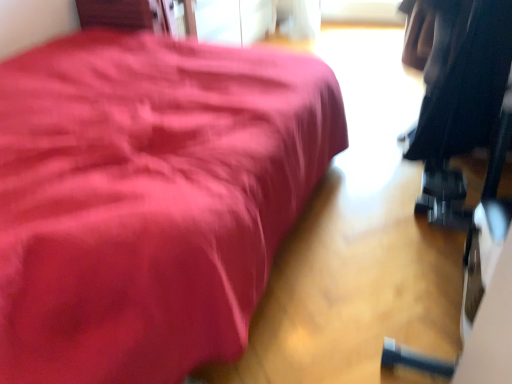
Question: Is matte black dumbbell at lower right wider or thinner than black fabric at right?

Choices:
 (A) thin
 (B) wide

Answer: (B)

Question: From a real-world perspective, relative to black fabric at right, is matte black dumbbell at lower right vertically above or below?

Choices:
 (A) below
 (B) above

Answer: (A)

Question: Does point (101, 382) appear closer or farther from the camera than point (471, 21)?

Choices:
 (A) closer
 (B) farther

Answer: (A)

Question: From the image's perspective, is black fabric at right positioned above or below matte black dumbbell at lower right?

Choices:
 (A) above
 (B) below

Answer: (B)

Question: Is black fabric at right inside or outside of matte black dumbbell at lower right?

Choices:
 (A) inside
 (B) outside

Answer: (B)

Question: Looking at their shapes, would you say black fabric at right is wider or thinner than matte black dumbbell at lower right?

Choices:
 (A) wide
 (B) thin

Answer: (B)

Question: From a real-world perspective, relative to matte black dumbbell at lower right, is black fabric at right vertically above or below?

Choices:
 (A) below
 (B) above

Answer: (B)